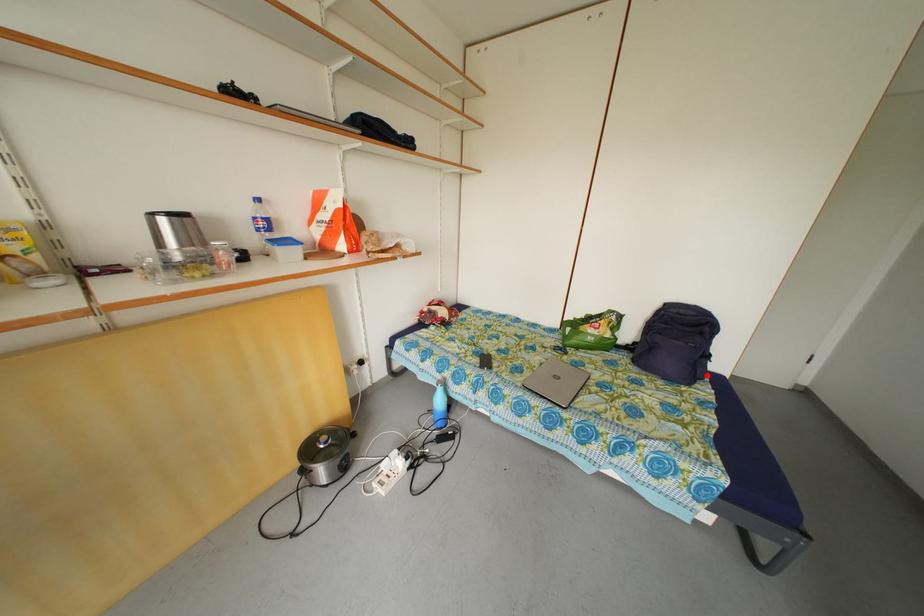
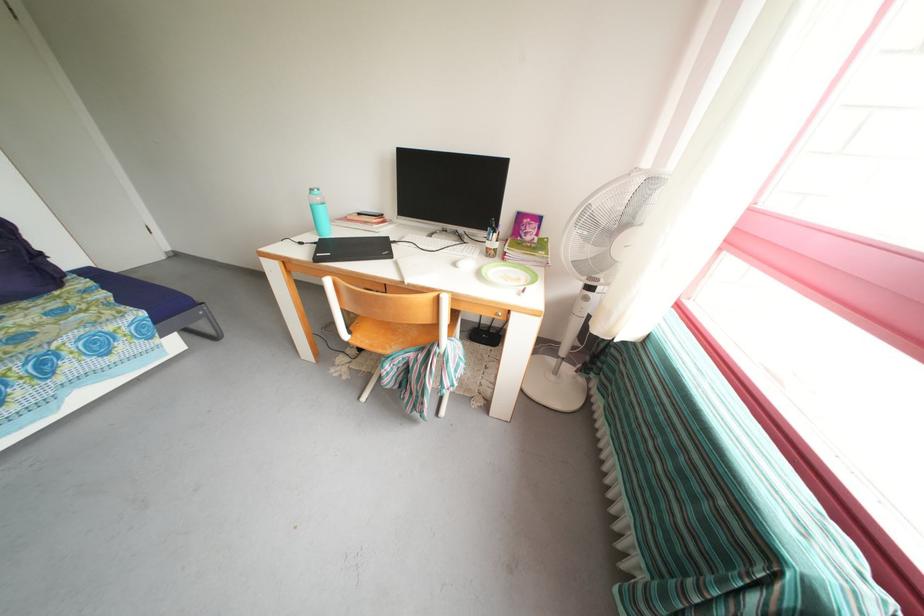
Find the pixel in the second image that matches the highlighted location in the first image.

(55, 276)